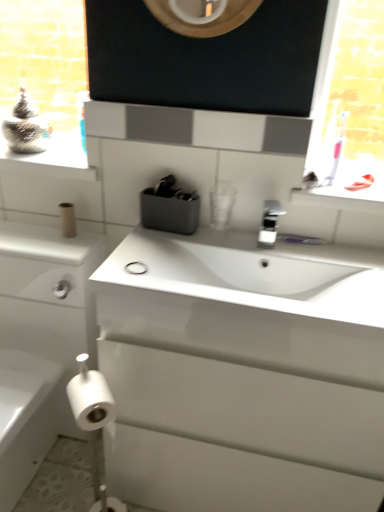
Question: Is metallic silver container at upper left positioned beyond the bounds of brown cardboard toilet paper at lower left, the 3th toilet paper ordered from the bottom?

Choices:
 (A) yes
 (B) no

Answer: (A)

Question: Can you confirm if metallic silver container at upper left is taller than brown cardboard toilet paper at lower left, acting as the 1th toilet paper starting from the back?

Choices:
 (A) no
 (B) yes

Answer: (B)

Question: Considering the relative sizes of metallic silver container at upper left and brown cardboard toilet paper at lower left, acting as the 1th toilet paper starting from the back, in the image provided, is metallic silver container at upper left bigger than brown cardboard toilet paper at lower left, acting as the 1th toilet paper starting from the back,?

Choices:
 (A) yes
 (B) no

Answer: (A)

Question: From the image's perspective, is metallic silver container at upper left located above brown cardboard toilet paper at lower left, the 3th toilet paper ordered from the bottom?

Choices:
 (A) yes
 (B) no

Answer: (A)

Question: From the image's perspective, is metallic silver container at upper left beneath brown cardboard toilet paper at lower left, which ranks as the third toilet paper in front-to-back order?

Choices:
 (A) no
 (B) yes

Answer: (A)

Question: Is metallic silver container at upper left behind brown cardboard toilet paper at lower left, which ranks as the third toilet paper in front-to-back order?

Choices:
 (A) yes
 (B) no

Answer: (B)

Question: Is white glossy cabinet at left facing towards silver metallic faucet at center?

Choices:
 (A) no
 (B) yes

Answer: (A)

Question: From the image's perspective, is white glossy cabinet at left located beneath silver metallic faucet at center?

Choices:
 (A) no
 (B) yes

Answer: (B)

Question: Is the position of white glossy cabinet at left more distant than that of silver metallic faucet at center?

Choices:
 (A) yes
 (B) no

Answer: (B)

Question: Is white glossy cabinet at left far away from silver metallic faucet at center?

Choices:
 (A) no
 (B) yes

Answer: (A)

Question: From a real-world perspective, is white glossy cabinet at left on silver metallic faucet at center?

Choices:
 (A) no
 (B) yes

Answer: (A)

Question: Is silver metallic faucet at center surrounded by white glossy cabinet at left?

Choices:
 (A) no
 (B) yes

Answer: (A)

Question: Is there a large distance between white glossy sink at center and white glossy window sill at upper right?

Choices:
 (A) yes
 (B) no

Answer: (B)